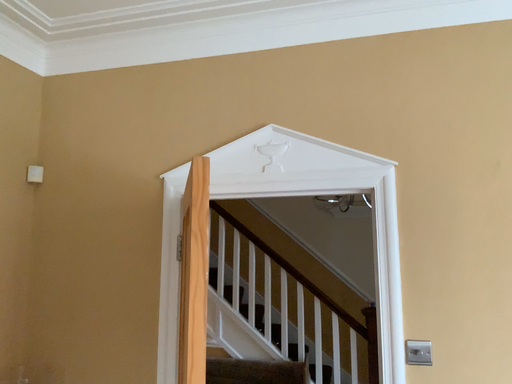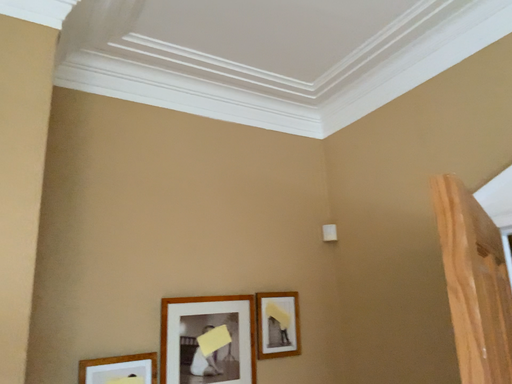
Question: Which way did the camera rotate in the video?

Choices:
 (A) rotated left
 (B) rotated right

Answer: (A)